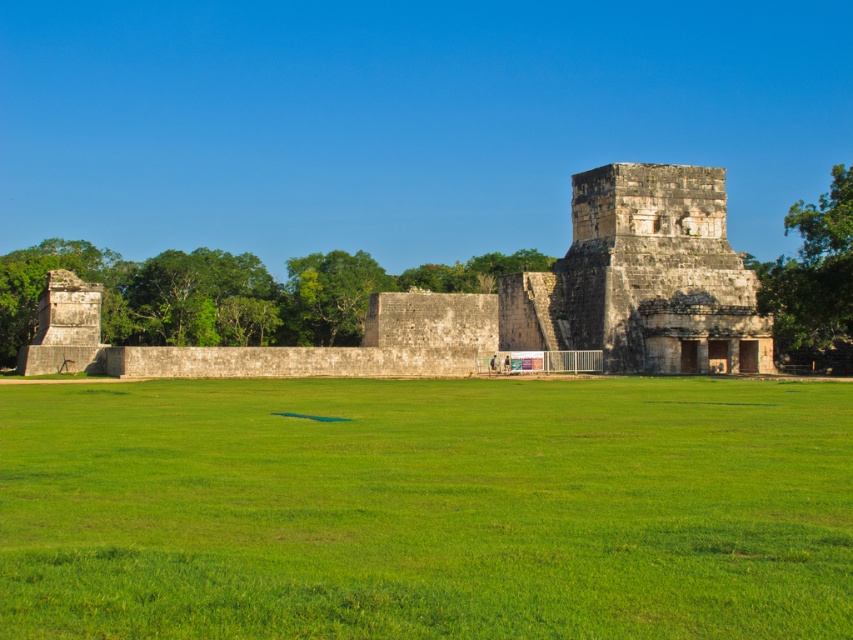
Question: Can you confirm if green grass at center is positioned to the right of stone ruins at center?

Choices:
 (A) no
 (B) yes

Answer: (B)

Question: Which point appears farthest from the camera in this image?

Choices:
 (A) (424, 392)
 (B) (180, 369)

Answer: (B)

Question: Which of the following is the farthest from the observer?

Choices:
 (A) stone ruins at center
 (B) green grass at center

Answer: (A)

Question: Observing the image, what is the correct spatial positioning of green grass at center in reference to stone ruins at center?

Choices:
 (A) below
 (B) above

Answer: (A)

Question: Is green grass at center to the right of stone ruins at center from the viewer's perspective?

Choices:
 (A) no
 (B) yes

Answer: (B)